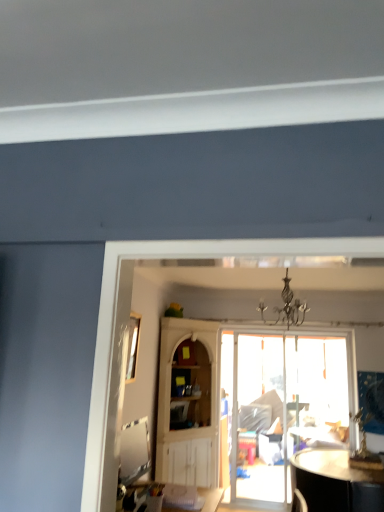
Question: Considering the relative sizes of white wood cabinet at center and translucent glass door at center in the image provided, is white wood cabinet at center smaller than translucent glass door at center?

Choices:
 (A) no
 (B) yes

Answer: (A)

Question: Is white wood cabinet at center oriented away from translucent glass door at center?

Choices:
 (A) yes
 (B) no

Answer: (B)

Question: From the image's perspective, does white wood cabinet at center appear lower than translucent glass door at center?

Choices:
 (A) yes
 (B) no

Answer: (B)

Question: From the image's perspective, is white wood cabinet at center located above translucent glass door at center?

Choices:
 (A) no
 (B) yes

Answer: (B)

Question: Are white wood cabinet at center and translucent glass door at center making contact?

Choices:
 (A) yes
 (B) no

Answer: (B)

Question: In terms of height, does black wrought iron chandelier at center look taller or shorter compared to translucent glass door at center?

Choices:
 (A) tall
 (B) short

Answer: (B)

Question: Considering the positions of black wrought iron chandelier at center and translucent glass door at center in the image, is black wrought iron chandelier at center wider or thinner than translucent glass door at center?

Choices:
 (A) wide
 (B) thin

Answer: (A)

Question: From a real-world perspective, is black wrought iron chandelier at center positioned above or below translucent glass door at center?

Choices:
 (A) below
 (B) above

Answer: (B)

Question: Is black wrought iron chandelier at center to the left or to the right of translucent glass door at center in the image?

Choices:
 (A) left
 (B) right

Answer: (A)

Question: Is translucent glass door at center taller or shorter than white wood cabinet at center?

Choices:
 (A) short
 (B) tall

Answer: (A)

Question: Is translucent glass door at center bigger or smaller than white wood cabinet at center?

Choices:
 (A) small
 (B) big

Answer: (A)

Question: Considering the positions of translucent glass door at center and white wood cabinet at center in the image, is translucent glass door at center wider or thinner than white wood cabinet at center?

Choices:
 (A) wide
 (B) thin

Answer: (B)

Question: Considering their positions, is translucent glass door at center located in front of or behind white wood cabinet at center?

Choices:
 (A) front
 (B) behind

Answer: (B)

Question: Considering the positions of point (129, 357) and point (294, 390), is point (129, 357) closer or farther from the camera than point (294, 390)?

Choices:
 (A) closer
 (B) farther

Answer: (A)

Question: In the image, is clear glass window at upper left on the left side or the right side of translucent glass door at center?

Choices:
 (A) left
 (B) right

Answer: (A)